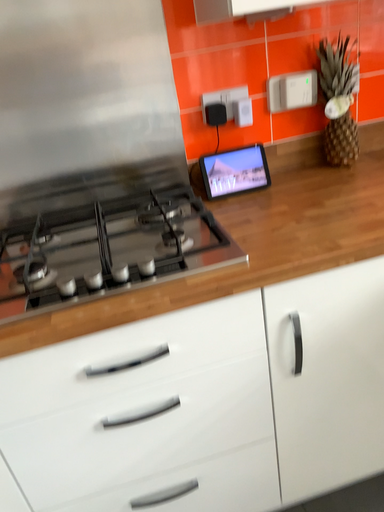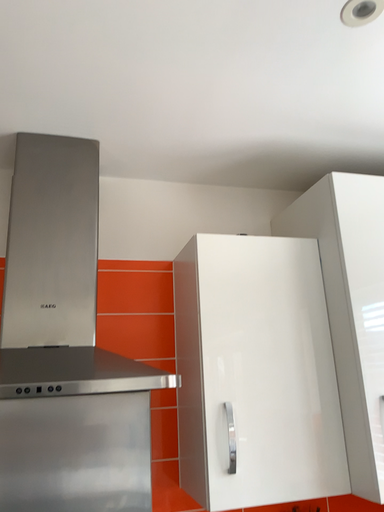
Question: Which way did the camera rotate in the video?

Choices:
 (A) rotated upward
 (B) rotated downward

Answer: (A)